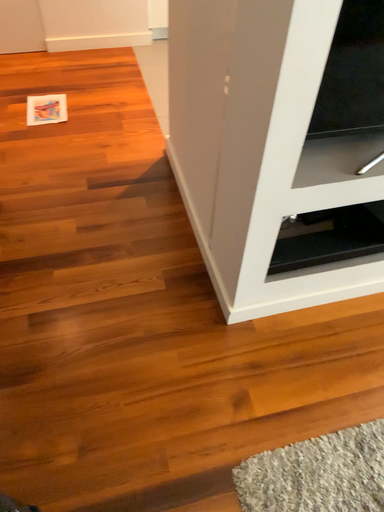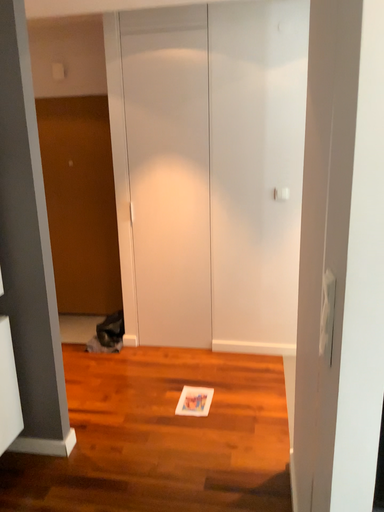
Question: Which way did the camera rotate in the video?

Choices:
 (A) rotated downward
 (B) rotated upward

Answer: (B)